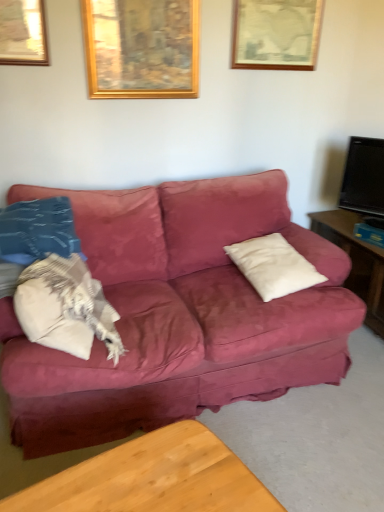
The height and width of the screenshot is (512, 384). What are the coordinates of `free space above wooden coffee table at lower center (from a real-world perspective)` in the screenshot? It's located at (165, 477).